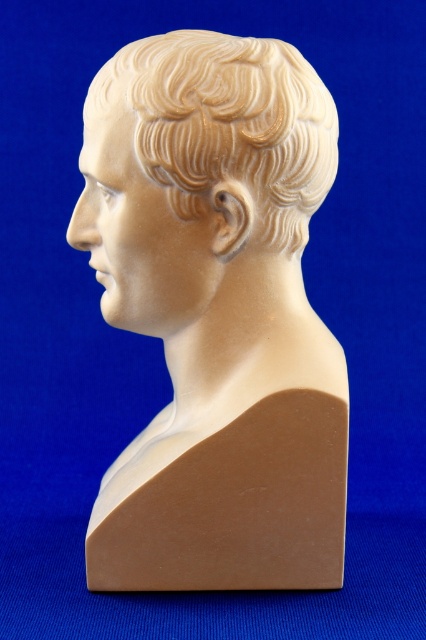
Question: Which point is farther to the camera?

Choices:
 (A) (253, 579)
 (B) (325, 97)

Answer: (B)

Question: Which of the following is the farthest from the observer?

Choices:
 (A) sandy beige wax hair at center
 (B) matte white bust at center

Answer: (B)

Question: Can you confirm if matte white bust at center is positioned to the right of sandy beige wax hair at center?

Choices:
 (A) no
 (B) yes

Answer: (A)

Question: Is matte white bust at center wider than sandy beige wax hair at center?

Choices:
 (A) yes
 (B) no

Answer: (A)

Question: Can you confirm if matte white bust at center is bigger than sandy beige wax hair at center?

Choices:
 (A) no
 (B) yes

Answer: (B)